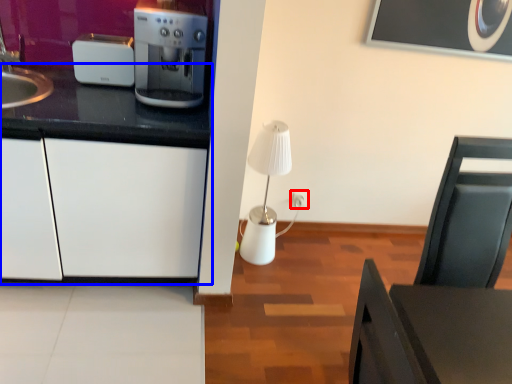
Question: Among these objects, which one is nearest to the camera, electric outlet (highlighted by a red box) or cabinetry (highlighted by a blue box)?

Choices:
 (A) electric outlet
 (B) cabinetry

Answer: (B)